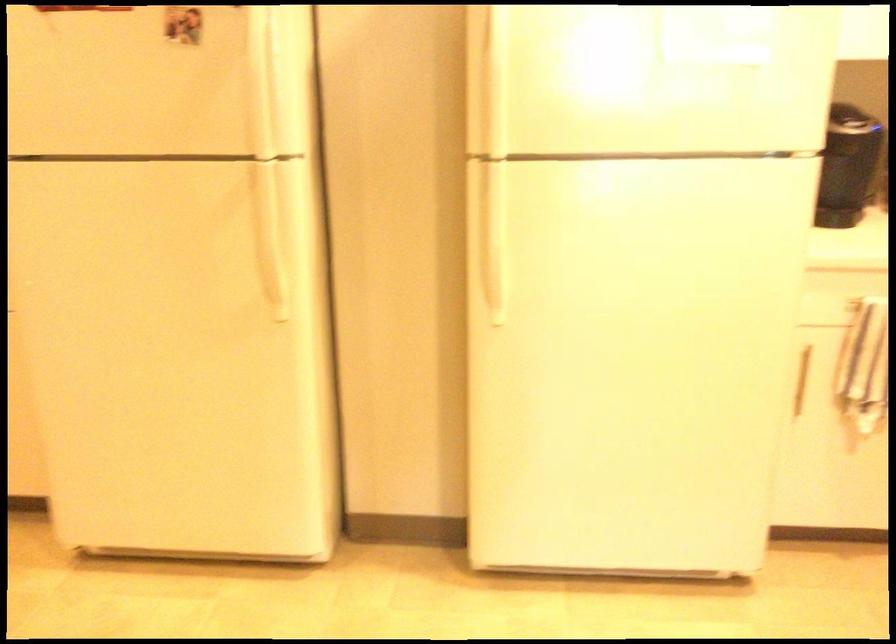
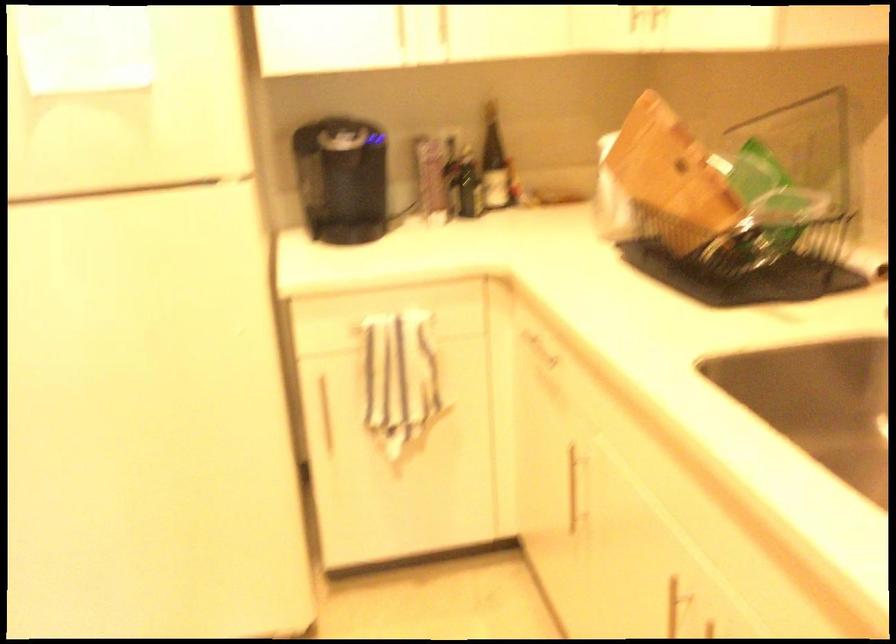
Locate, in the second image, the point that corresponds to pixel 798 379 in the first image.

(323, 412)